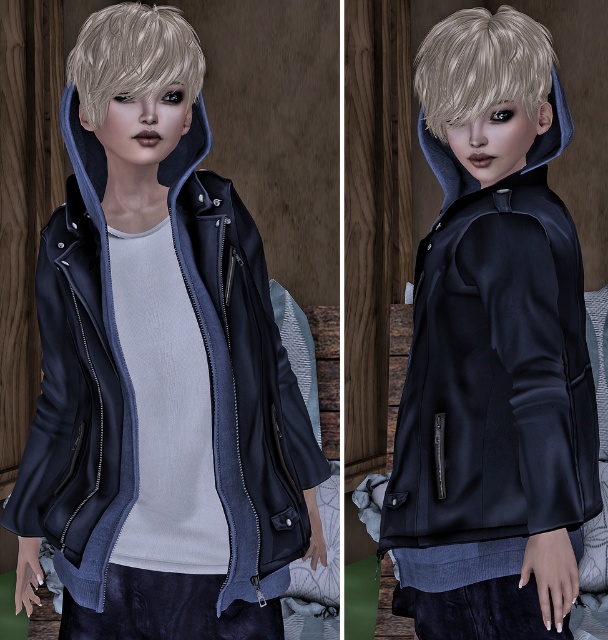
You are designing a virtual fitting room and need to ensure the matte black jacket at center and blondehair at upper center are scaled appropriately. Based on the scene, which object should be scaled down to maintain realistic proportions?

The matte black jacket at center should be scaled down because it is currently larger than the blondehair at upper center, which is not realistic as the jacket should not overshadow the hair in terms of size.

What are the coordinates of the matte black jacket at center?

The coordinates of the matte black jacket at center are at point (x=157, y=365).